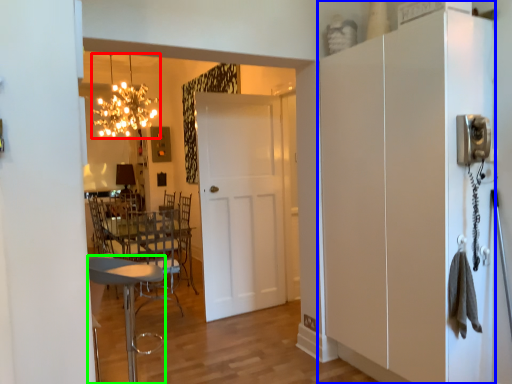
Question: Which object is the closest to the light fixture (highlighted by a red box)? Choose among these: cabinetry (highlighted by a blue box) or chair (highlighted by a green box).

Choices:
 (A) cabinetry
 (B) chair

Answer: (B)